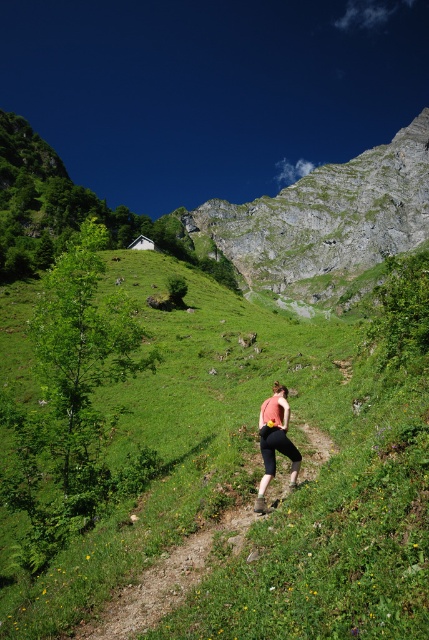
Between rugged stone mountain at upper center and brown dirt path at center, which one has less height?

brown dirt path at center is shorter.

Is rugged stone mountain at upper center positioned in front of brown dirt path at center?

No, it is behind brown dirt path at center.

Where is `rugged stone mountain at upper center`? The image size is (429, 640). rugged stone mountain at upper center is located at coordinates (326, 221).

Does brown dirt path at center have a smaller size compared to matte pink tank top at center?

No, brown dirt path at center is not smaller than matte pink tank top at center.

I want to click on brown dirt path at center, so click(168, 579).

Where is `brown dirt path at center`? The image size is (429, 640). brown dirt path at center is located at coordinates (168, 579).

Describe the element at coordinates (221, 483) in the screenshot. Image resolution: width=429 pixels, height=640 pixels. I see `green grassy at center` at that location.

Which is behind, point (374, 355) or point (274, 426)?

Positioned behind is point (374, 355).

Find the location of a particular element. green grassy at center is located at coordinates (221, 483).